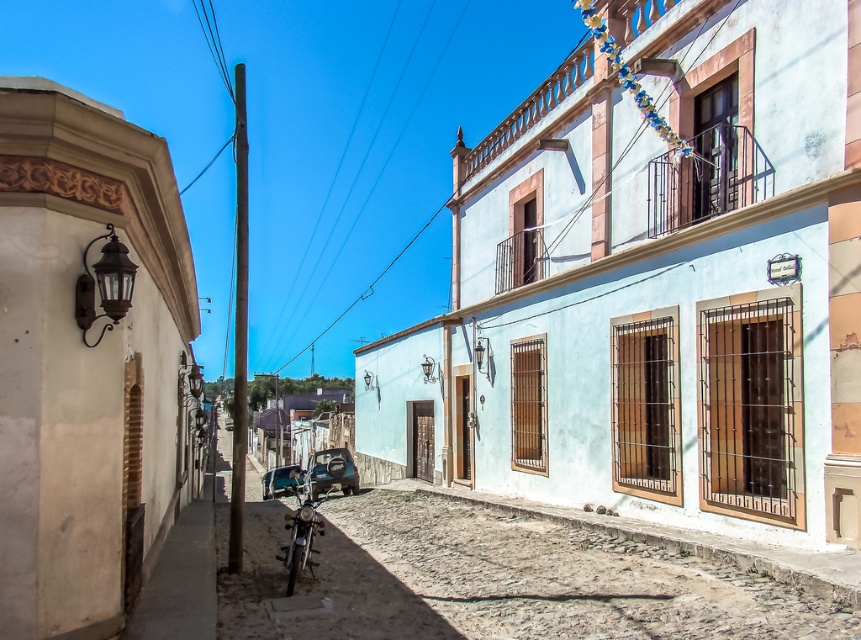
You are standing on the cobblestone street in the historic town and want to walk from point (407, 118) to point (361, 298). Which direction should you move relative to the buildings?

You should move away from the buildings because point (407, 118) is closer to the buildings than point (361, 298).

You are standing in the historic town square and want to take a photo that includes both the soft blue building with the flower balcony and the motorcycle. You notice two points marked on the ground at coordinates point (323, 531) and point (381, 170). Which point should you stand closer to ensure both the building and the motorcycle are in frame without moving the camera?

You should stand closer to point (323, 531) because it is closer to the camera than point (381, 170), allowing both the soft blue building with the flower balcony and the motorcycle to be in frame without moving the camera.